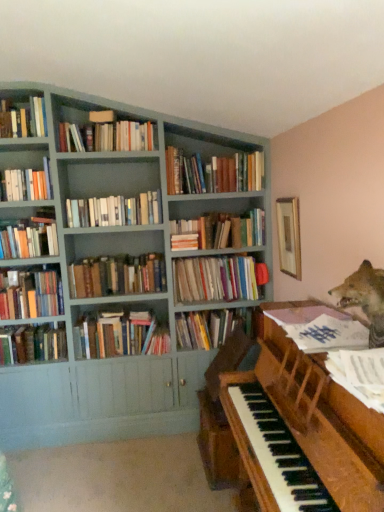
This screenshot has width=384, height=512. What do you see at coordinates (115, 210) in the screenshot? I see `hardcover books at center, the fifth book in the top-to-bottom sequence` at bounding box center [115, 210].

Measure the distance between point (274, 422) and camera.

Point (274, 422) and camera are 1.76 meters apart from each other.

At what (x,y) coordinates should I click in order to perform the action: click on hardcover books at center, the eleventh book positioned from the bottom. Please return your answer as a coordinate pair (x, y). This screenshot has width=384, height=512. Looking at the image, I should click on (115, 210).

Which object is positioned more to the right, hardcover books at upper left, placed as the first book when sorted from top to bottom, or hardcover books at center, which is the 6th book in top-to-bottom order?

hardcover books at center, which is the 6th book in top-to-bottom order, is more to the right.

Looking at this image, which is in front, hardcover books at upper left, placed as the first book when sorted from top to bottom, or hardcover books at center, which is the 6th book in top-to-bottom order?

hardcover books at upper left, placed as the first book when sorted from top to bottom, is more forward.

Is hardcover books at upper left, placed as the 15th book when sorted from bottom to top, not close to hardcover books at center, the tenth book positioned from the bottom?

Yes, hardcover books at upper left, placed as the 15th book when sorted from bottom to top, and hardcover books at center, the tenth book positioned from the bottom, are quite far apart.

Is point (16, 113) farther from viewer compared to point (260, 226)?

No.

In the image, is wooden picture frame at upper right positioned in front of or behind white paper music at right, which is counted as the fifth book, starting from the bottom?

wooden picture frame at upper right is behind white paper music at right, which is counted as the fifth book, starting from the bottom.

Is white paper music at right, arranged as the eleventh book when viewed from the top, surrounded by wooden picture frame at upper right?

Definitely not — white paper music at right, arranged as the eleventh book when viewed from the top, is not inside wooden picture frame at upper right.

From the image's perspective, is wooden picture frame at upper right located above white paper music at right, arranged as the eleventh book when viewed from the top?

Correct, wooden picture frame at upper right appears higher than white paper music at right, arranged as the eleventh book when viewed from the top, in the image.

From a real-world perspective, which object rests below the other?

In real-world perspective, white paper music at right, which is counted as the fifth book, starting from the bottom, is lower.

From the image's perspective, is wooden piano at lower right located beneath matte gray bookcase at upper left?

Yes.

Does wooden piano at lower right lie in front of matte gray bookcase at upper left?

Yes, wooden piano at lower right is closer to the camera.

Is wooden piano at lower right spatially inside matte gray bookcase at upper left, or outside of it?

wooden piano at lower right is not inside matte gray bookcase at upper left, it's outside.

Based on the photo, can we say hardcover books at center, placed as the third book when sorted from top to bottom, lies outside hardcover books at center, the tenth book positioned from the bottom?

Yes.

Who is more distant, hardcover books at center, the thirteenth book from the bottom, or hardcover books at center, the tenth book positioned from the bottom?

hardcover books at center, the tenth book positioned from the bottom, is further away from the camera.

Is point (203, 165) positioned behind point (183, 227)?

No, it is not.

Is hardcover books at center, the thirteenth book from the bottom, positioned with its back to hardcover books at center, the tenth book positioned from the bottom?

No, hardcover books at center, the thirteenth book from the bottom, is not facing away from hardcover books at center, the tenth book positioned from the bottom.

Does hardcover books at left, which ranks as the first book in bottom-to-top order, turn towards hardcover books at center, the thirteenth book from the bottom?

No.

Looking at this image, would you say hardcover books at left, positioned as the fifteenth book in top-to-bottom order, is outside hardcover books at center, placed as the third book when sorted from top to bottom?

Yes, hardcover books at left, positioned as the fifteenth book in top-to-bottom order, is not within hardcover books at center, placed as the third book when sorted from top to bottom.

From the image's perspective, which one is positioned lower, hardcover books at left, which ranks as the first book in bottom-to-top order, or hardcover books at center, placed as the third book when sorted from top to bottom?

hardcover books at left, which ranks as the first book in bottom-to-top order, is shown below in the image.

Measure the distance from hardcover books at left, positioned as the fifteenth book in top-to-bottom order, to hardcover books at center, placed as the third book when sorted from top to bottom.

hardcover books at left, positioned as the fifteenth book in top-to-bottom order, is 4.81 feet from hardcover books at center, placed as the third book when sorted from top to bottom.

From the image's perspective, is hardcover books at center, the tenth book positioned from the bottom, on hardcover books at center, the thirteenth book from the bottom?

No, from the image's perspective, hardcover books at center, the tenth book positioned from the bottom, is not on top of hardcover books at center, the thirteenth book from the bottom.

Which object is more forward, hardcover books at center, which is the 6th book in top-to-bottom order, or hardcover books at center, placed as the third book when sorted from top to bottom?

Positioned in front is hardcover books at center, placed as the third book when sorted from top to bottom.

Considering the relative sizes of hardcover books at center, the tenth book positioned from the bottom, and hardcover books at center, the thirteenth book from the bottom, in the image provided, is hardcover books at center, the tenth book positioned from the bottom, shorter than hardcover books at center, the thirteenth book from the bottom,?

Indeed, hardcover books at center, the tenth book positioned from the bottom, has a lesser height compared to hardcover books at center, the thirteenth book from the bottom.

Is matte gray bookcase at upper left next to hardcover books at center, the 2th book when ordered from bottom to top, and touching it?

No, matte gray bookcase at upper left is not beside hardcover books at center, the 2th book when ordered from bottom to top.

From the image's perspective, relative to hardcover books at center, the fourteenth book viewed from the top, is matte gray bookcase at upper left above or below?

From the image's perspective, matte gray bookcase at upper left appears above hardcover books at center, the fourteenth book viewed from the top.

Does matte gray bookcase at upper left contain hardcover books at center, the fourteenth book viewed from the top?

Yes, matte gray bookcase at upper left contains hardcover books at center, the fourteenth book viewed from the top.

Image resolution: width=384 pixels, height=512 pixels. Find the location of `book that is the 8th one when counting rightward from the hardcover books at upper left, placed as the 15th book when sorted from bottom to top`. book that is the 8th one when counting rightward from the hardcover books at upper left, placed as the 15th book when sorted from bottom to top is located at coordinates (220, 231).

From the image's perspective, which book is the 4th one below the wooden picture frame at upper right? Please provide its 2D coordinates.

[(320, 328)]

Which object lies further to the anchor point hardcover books at center, the eleventh book positioned from the bottom, shiny brown fox at upper right or hardcover books at center, which is the ninth book from top to bottom?

Based on the image, shiny brown fox at upper right appears to be further to hardcover books at center, the eleventh book positioned from the bottom.

Considering their positions, is hardcover books at center, the fourteenth book viewed from the top, positioned closer to hardcover book at center, marked as the 13th book in a top-to-bottom arrangement, than wooden picture frame at upper right?

Based on the image, hardcover books at center, the fourteenth book viewed from the top, appears to be nearer to hardcover book at center, marked as the 13th book in a top-to-bottom arrangement.

Considering their positions, is hardcover books at center, the 2th book when ordered from bottom to top, positioned further to hardcover books at upper center, the second book from the top, than hardcover books at center, marked as the 8th book in a top-to-bottom arrangement?

hardcover books at center, the 2th book when ordered from bottom to top, lies further to hardcover books at upper center, the second book from the top, than the other object.

Based on their spatial positions, is wooden picture frame at upper right or hardcover book at center, the third book positioned from the bottom, closer to hardcover books at center, the 2th book when ordered from bottom to top?

hardcover book at center, the third book positioned from the bottom, is closer to hardcover books at center, the 2th book when ordered from bottom to top.

Looking at this image, from the image, which object appears to be nearer to shiny brown fox at upper right, hardcover books at center, the 2th book when ordered from bottom to top, or wooden piano at lower right?

wooden piano at lower right.

From the image, which object appears to be farther from hardcover books at upper left, placed as the first book when sorted from top to bottom, white paper at piano, which appears as the 4th book when ordered from the bottom, or hardcover books at center, placed as the third book when sorted from top to bottom?

Among the two, white paper at piano, which appears as the 4th book when ordered from the bottom, is located further to hardcover books at upper left, placed as the first book when sorted from top to bottom.

When comparing their distances from wooden picture frame at upper right, does shiny brown fox at upper right or hardcover books at upper left, placed as the 15th book when sorted from bottom to top, seem further?

hardcover books at upper left, placed as the 15th book when sorted from bottom to top, is further to wooden picture frame at upper right.

Considering their positions, is hardcover books at left, which ranks as the first book in bottom-to-top order, positioned further to white paper at piano, which appears as the 4th book when ordered from the bottom, than hardcover books at left, arranged as the tenth book when viewed from the top?

hardcover books at left, which ranks as the first book in bottom-to-top order, is positioned further to the anchor white paper at piano, which appears as the 4th book when ordered from the bottom.

You are a GUI agent. You are given a task and a screenshot of the screen. Output one action in this format:
    pyautogui.click(x=<x>, y=<y>)
    Task: Click on the bookcase between wooden piano at lower right and hardcover books at left, which appears as the 6th book when ordered from the bottom, from front to back
    The image size is (384, 512).
    Given the screenshot: What is the action you would take?
    pyautogui.click(x=113, y=295)

Identify the location of bookcase located between white paper music at right, arranged as the eleventh book when viewed from the top, and hardcover books at center, the seventh book from the bottom, in the depth direction. (113, 295).

At what (x,y) coordinates should I click in order to perform the action: click on bookcase between hardcover books at upper center, marked as the 14th book in a bottom-to-top arrangement, and hardcover books at center, which is counted as the 8th book, starting from the bottom, in the up-down direction. Please return your answer as a coordinate pair (x, y). The width and height of the screenshot is (384, 512). Looking at the image, I should click on (113, 295).

Identify the location of picture frame between white paper at piano, which appears as the 4th book when ordered from the bottom, and hardcover books at center, placed as the third book when sorted from top to bottom, along the z-axis. (289, 236).